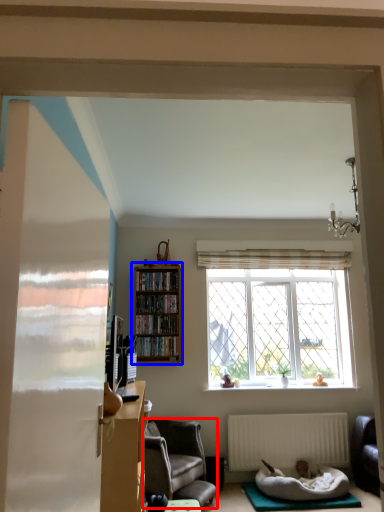
Question: Which point is further to the camera, chair (highlighted by a red box) or bookcase (highlighted by a blue box)?

Choices:
 (A) chair
 (B) bookcase

Answer: (B)